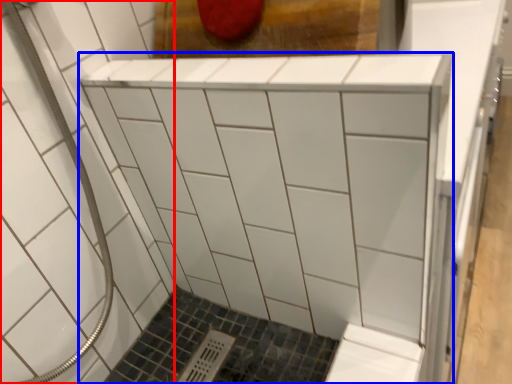
Question: Which point is closer to the camera, bath (highlighted by a red box) or furniture (highlighted by a blue box)?

Choices:
 (A) bath
 (B) furniture

Answer: (A)